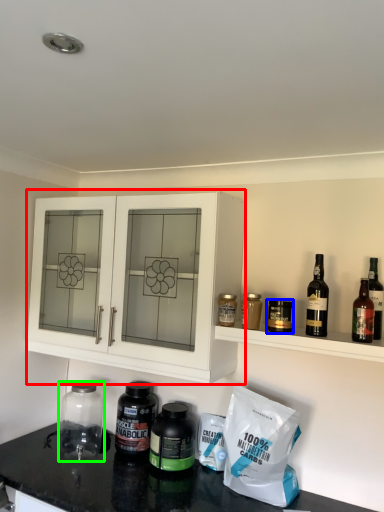
Question: Considering the real-world distances, which object is closest to cabinetry (highlighted by a red box)? bottle (highlighted by a blue box) or glass jar (highlighted by a green box).

Choices:
 (A) bottle
 (B) glass jar

Answer: (B)